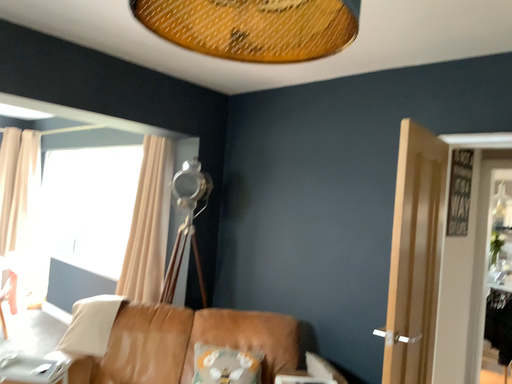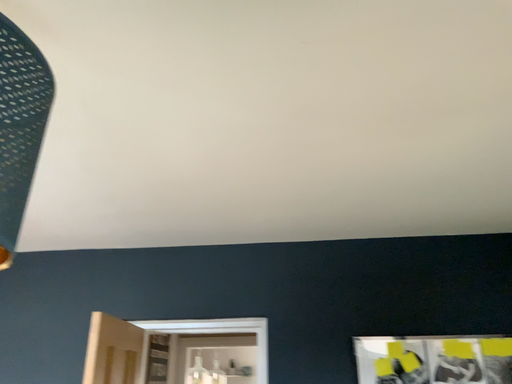
Question: Which way did the camera rotate in the video?

Choices:
 (A) rotated left
 (B) rotated right

Answer: (B)